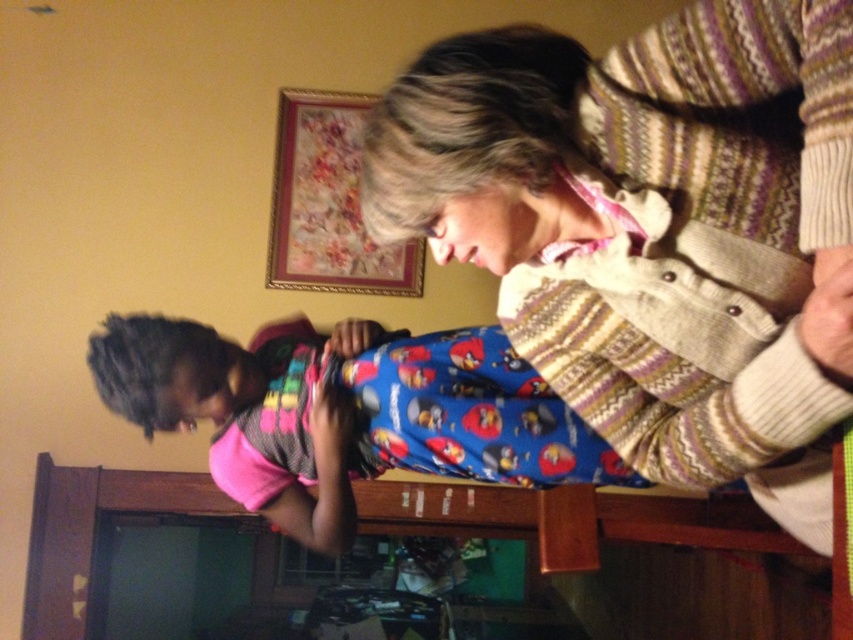
You are standing in the room shown in the image and want to reach the striped knit sweater at upper right. The coordinates of the sweater are given as point (653, 228). If you start from the center of the room, in which direction should you move to get closer to the sweater?

The striped knit sweater at upper right is located at point (653, 228). Since the coordinate system typically has the origin at the bottom left corner, moving towards the upper right direction from the center would bring you closer to the sweater.

You are a photographer trying to capture a clear shot of the blue cotton pajama at center without any obstruction. Given that the striped knit sweater at upper right is covering part of it, can you adjust your position to avoid the obstruction?

The striped knit sweater at upper right is positioned over the blue cotton pajama at center, so moving your camera angle slightly downward or to the side might allow you to capture the blue cotton pajama at center without the obstruction from the striped knit sweater at upper right.